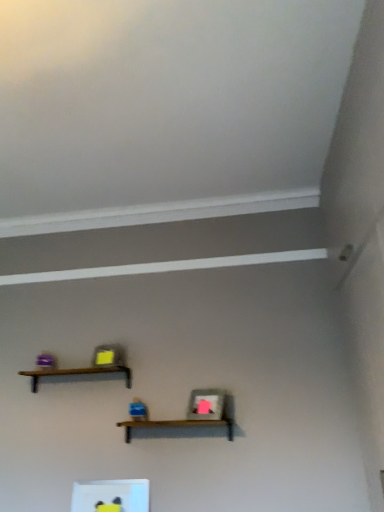
Question: Is brown wooden shelf at upper center, which is the 1th shelf in top-to-bottom order, located outside brown wooden shelf at center, which appears as the 2th shelf when viewed from the top?

Choices:
 (A) no
 (B) yes

Answer: (B)

Question: From a real-world perspective, is brown wooden shelf at upper center, the third shelf in the bottom-to-top sequence, positioned under brown wooden shelf at center, the 2th shelf in the bottom-to-top sequence, based on gravity?

Choices:
 (A) no
 (B) yes

Answer: (A)

Question: Can you confirm if brown wooden shelf at upper center, the third shelf in the bottom-to-top sequence, is bigger than brown wooden shelf at center, which appears as the 2th shelf when viewed from the top?

Choices:
 (A) yes
 (B) no

Answer: (B)

Question: Does brown wooden shelf at upper center, the third shelf in the bottom-to-top sequence, have a greater height compared to brown wooden shelf at center, which appears as the 2th shelf when viewed from the top?

Choices:
 (A) yes
 (B) no

Answer: (B)

Question: From a real-world perspective, is brown wooden shelf at upper center, which is the 1th shelf in top-to-bottom order, on top of brown wooden shelf at center, which appears as the 2th shelf when viewed from the top?

Choices:
 (A) yes
 (B) no

Answer: (A)

Question: From the image's perspective, does brown wooden shelf at upper center, which is the 1th shelf in top-to-bottom order, appear lower than brown wooden shelf at center, the 2th shelf in the bottom-to-top sequence?

Choices:
 (A) yes
 (B) no

Answer: (B)

Question: Is brown wooden shelf at upper center, which is the 1th shelf in top-to-bottom order, completely or partially outside of white glossy frame at lower center, which is the 1th shelf from bottom to top?

Choices:
 (A) no
 (B) yes

Answer: (B)

Question: Is brown wooden shelf at upper center, the third shelf in the bottom-to-top sequence, smaller than white glossy frame at lower center, which ranks as the third shelf in top-to-bottom order?

Choices:
 (A) no
 (B) yes

Answer: (A)

Question: Is brown wooden shelf at upper center, which is the 1th shelf in top-to-bottom order, bigger than white glossy frame at lower center, which is the 1th shelf from bottom to top?

Choices:
 (A) yes
 (B) no

Answer: (A)

Question: Is brown wooden shelf at upper center, which is the 1th shelf in top-to-bottom order, shorter than white glossy frame at lower center, which ranks as the third shelf in top-to-bottom order?

Choices:
 (A) no
 (B) yes

Answer: (B)

Question: Is brown wooden shelf at upper center, which is the 1th shelf in top-to-bottom order, closer to camera compared to white glossy frame at lower center, which ranks as the third shelf in top-to-bottom order?

Choices:
 (A) no
 (B) yes

Answer: (A)

Question: Is the position of brown wooden shelf at upper center, which is the 1th shelf in top-to-bottom order, more distant than that of white glossy frame at lower center, which is the 1th shelf from bottom to top?

Choices:
 (A) no
 (B) yes

Answer: (B)

Question: Is white glossy frame at lower center, which is the 1th shelf from bottom to top, facing towards brown wooden shelf at upper center, which is the 1th shelf in top-to-bottom order?

Choices:
 (A) no
 (B) yes

Answer: (A)